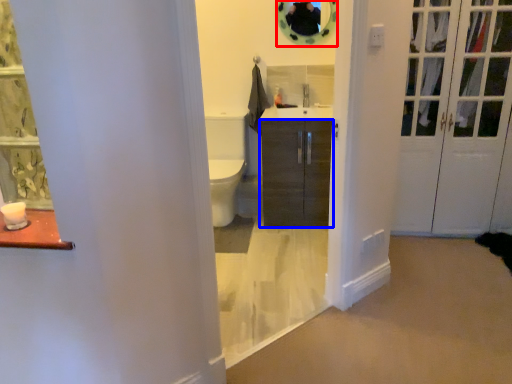
Question: Among these objects, which one is nearest to the camera, mirror (highlighted by a red box) or cabinetry (highlighted by a blue box)?

Choices:
 (A) mirror
 (B) cabinetry

Answer: (B)